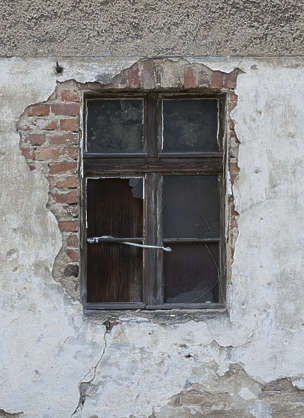
Locate an element on the screen. middle windows is located at coordinates (134, 199), (200, 186).